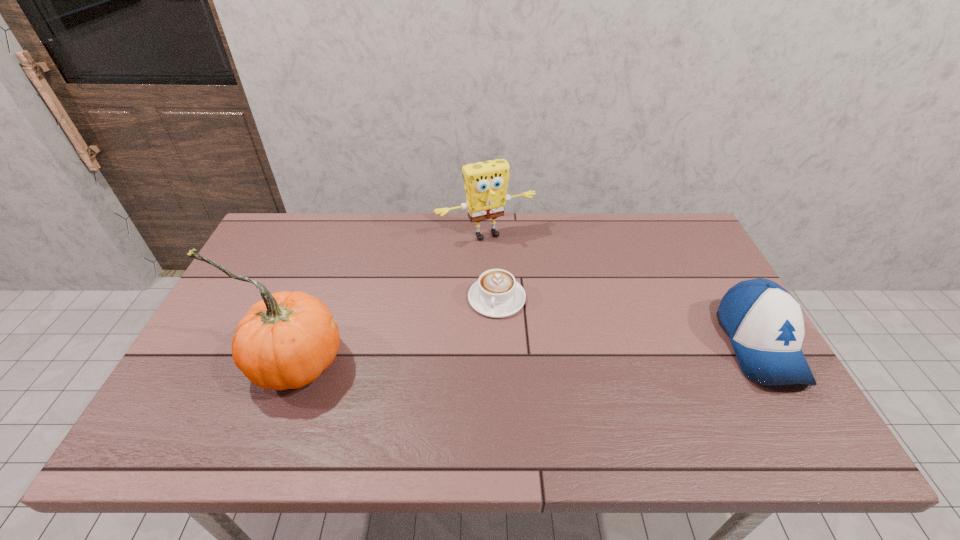
Locate an element on the screen. This screenshot has height=540, width=960. free space between the second tallest object and the second shortest object is located at coordinates (622, 289).

The height and width of the screenshot is (540, 960). What are the coordinates of `vacant space in between the rightmost object and the sponge` in the screenshot? It's located at (622, 289).

Locate an element on the screen. Image resolution: width=960 pixels, height=540 pixels. free spot between the sponge and the cappuccino is located at coordinates (492, 266).

You are a GUI agent. You are given a task and a screenshot of the screen. Output one action in this format:
    pyautogui.click(x=<x>, y=<y>)
    Task: Click on the empty space between the shortest object and the third tallest object
    The height and width of the screenshot is (540, 960).
    Given the screenshot: What is the action you would take?
    (628, 321)

The width and height of the screenshot is (960, 540). In order to click on vacant space that is in between the third tallest object and the shortest object in this screenshot , I will do `click(628, 321)`.

The image size is (960, 540). In order to click on vacant point located between the second shortest object and the cappuccino in this screenshot , I will do `click(628, 321)`.

Identify which object is the third closest to the cappuccino. Please provide its 2D coordinates. Your answer should be formatted as a tuple, i.e. [(x, y)], where the tuple contains the x and y coordinates of a point satisfying the conditions above.

[(764, 322)]

Locate an element on the screen. This screenshot has width=960, height=540. object that is the third closest to the farthest object is located at coordinates (764, 322).

I want to click on free space that satisfies the following two spatial constraints: 1. on the front side of the cappuccino; 2. on the left side of the third shortest object, so click(487, 298).